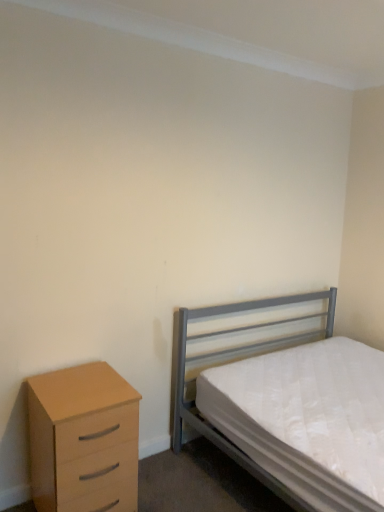
The height and width of the screenshot is (512, 384). In order to click on free spot to the right of light wood/veneer chest of drawers at left in this screenshot , I will do `click(169, 488)`.